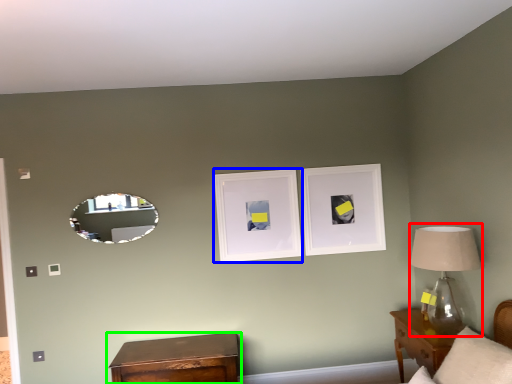
Question: Estimate the real-world distances between objects in this image. Which object is closer to table lamp (highlighted by a red box), picture frame (highlighted by a blue box) or nightstand (highlighted by a green box)?

Choices:
 (A) picture frame
 (B) nightstand

Answer: (A)